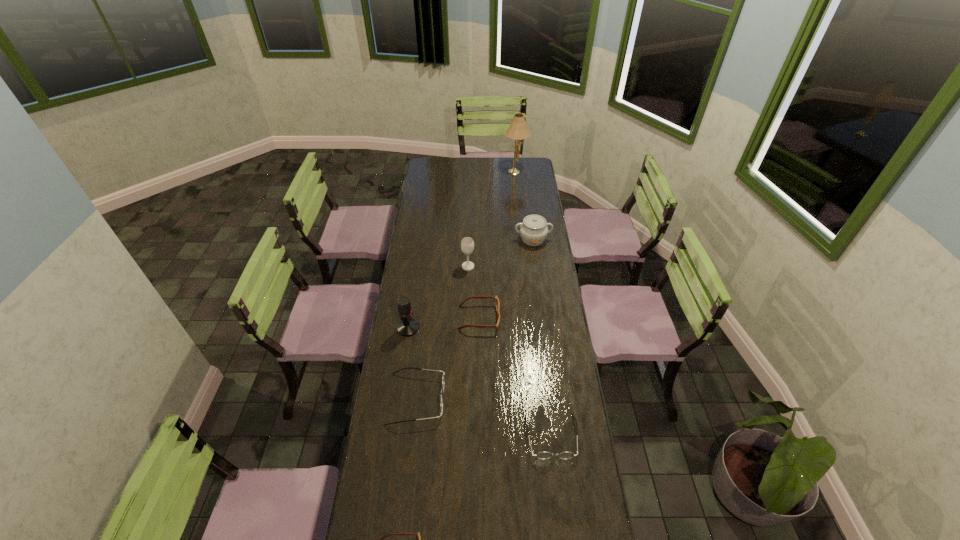
You are a GUI agent. You are given a task and a screenshot of the screen. Output one action in this format:
    pyautogui.click(x=<x>, y=<y>)
    Task: Click on the microphone positioned at the left edge
    This screenshot has height=540, width=960.
    Given the screenshot: What is the action you would take?
    pyautogui.click(x=407, y=326)

Identify the location of spectacles positioned at the left edge. (441, 396).

What are the coordinates of `lampshade that is at the right edge` in the screenshot? It's located at (518, 130).

Identify the location of chinaware that is at the right edge. The image size is (960, 540). (533, 230).

Where is `spectacles positioned at the right edge`? This screenshot has width=960, height=540. spectacles positioned at the right edge is located at coordinates (542, 455).

This screenshot has height=540, width=960. Find the location of `object that is at the far right corner`. object that is at the far right corner is located at coordinates (518, 130).

Find the location of a particular element. The width and height of the screenshot is (960, 540). vacant region at the far edge of the desktop is located at coordinates (489, 167).

The height and width of the screenshot is (540, 960). Identify the location of free space at the left edge of the desktop. (420, 215).

Identify the location of vacant position at the right edge of the desktop. (596, 504).

The height and width of the screenshot is (540, 960). Identify the location of free spot at the far right corner of the desktop. (522, 159).